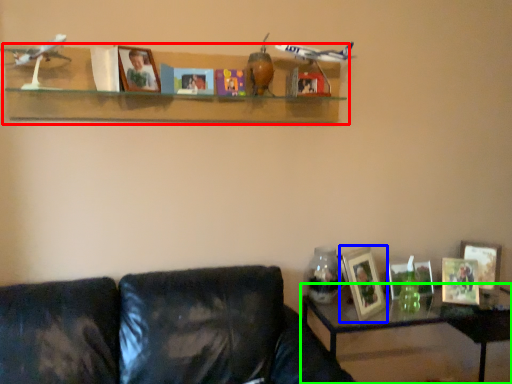
Question: Which object is positioned closest to shelf (highlighted by a red box)? Select from picture frame (highlighted by a blue box) and table (highlighted by a green box).

Choices:
 (A) picture frame
 (B) table

Answer: (A)